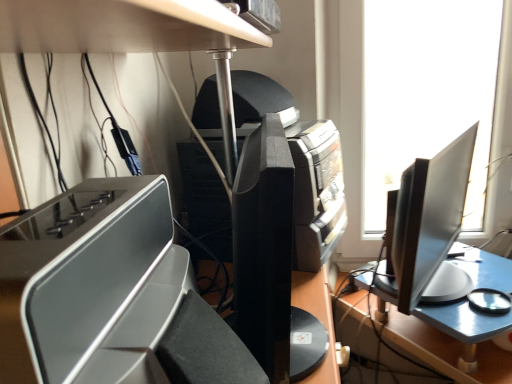
Question: Considering the positions of point (326, 375) and point (238, 147), is point (326, 375) closer or farther from the camera than point (238, 147)?

Choices:
 (A) farther
 (B) closer

Answer: (B)

Question: Is white matte plastic tray at center taller or shorter than black plastic printer at center?

Choices:
 (A) short
 (B) tall

Answer: (A)

Question: Is white matte plastic tray at center bigger or smaller than black plastic printer at center?

Choices:
 (A) big
 (B) small

Answer: (B)

Question: Does point (331, 153) appear closer or farther from the camera than point (303, 299)?

Choices:
 (A) farther
 (B) closer

Answer: (A)

Question: Considering their positions, is black plastic printer at center located in front of or behind white matte plastic tray at center?

Choices:
 (A) front
 (B) behind

Answer: (B)

Question: From the image's perspective, is black plastic printer at center located above or below white matte plastic tray at center?

Choices:
 (A) above
 (B) below

Answer: (A)

Question: Is black plastic printer at center wider or thinner than white matte plastic tray at center?

Choices:
 (A) thin
 (B) wide

Answer: (B)